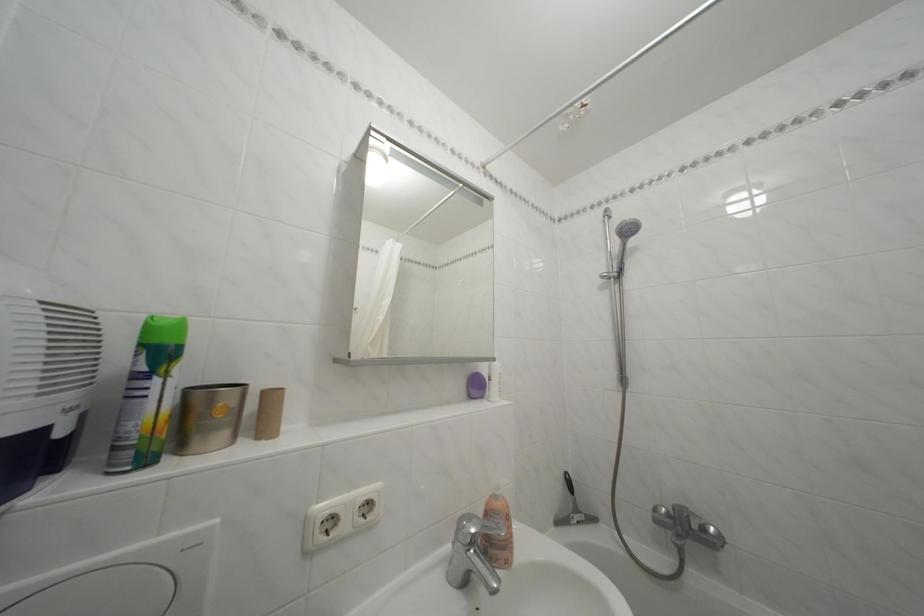
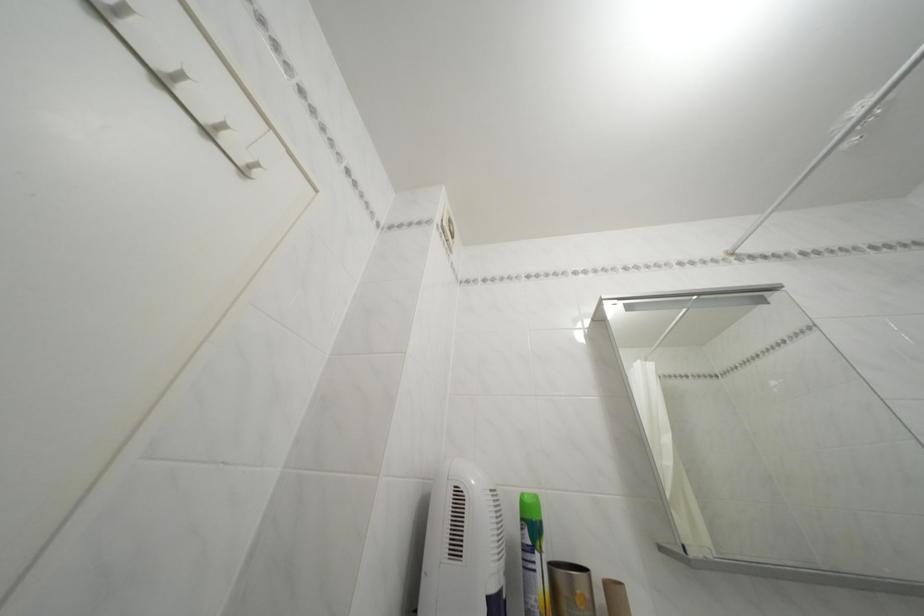
In the second image, find the point that corresponds to [150,351] in the first image.

(531, 525)